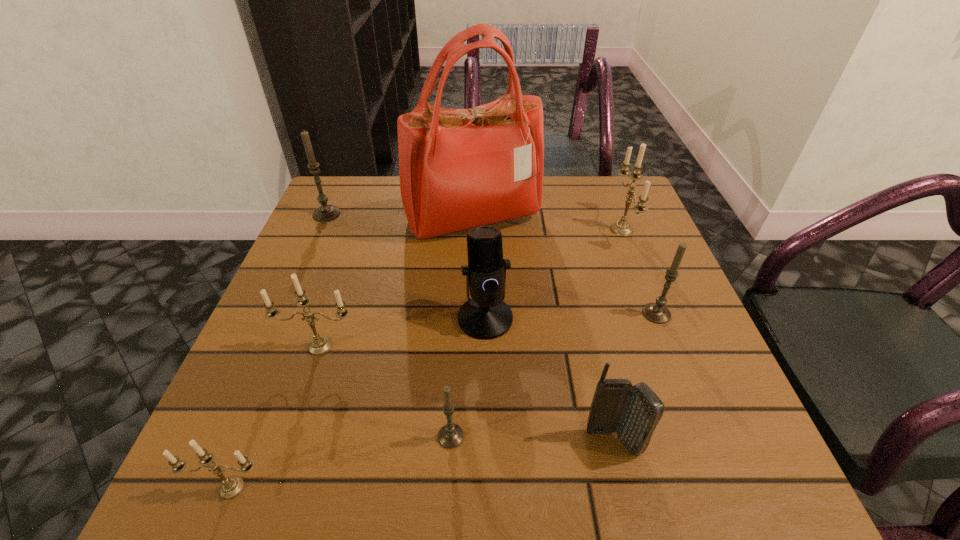
Locate an element on the screen. The height and width of the screenshot is (540, 960). empty space that is in between the leftmost gray candle and the second gray candle from right to left is located at coordinates (389, 325).

At what (x,y) coordinates should I click in order to perform the action: click on free space between the second farthest gray candle and the tallest object. Please return your answer as a coordinate pair (x, y). Looking at the image, I should click on (564, 266).

Locate an element on the screen. object that stands as the second closest to the black microphone is located at coordinates point(450,436).

Find the location of a particular element. The width and height of the screenshot is (960, 540). the fifth closest object to the leftmost gray candle is located at coordinates (231, 487).

You are a GUI agent. You are given a task and a screenshot of the screen. Output one action in this format:
    pyautogui.click(x=<x>, y=<y>)
    Task: Click on the candle object that ranks as the fourth closest to the rightmost gray candle
    The image size is (960, 540).
    Given the screenshot: What is the action you would take?
    pyautogui.click(x=231, y=487)

The width and height of the screenshot is (960, 540). Identify the location of candle that stands as the second closest to the second farthest gray candle. (450, 436).

Locate which metallic candle ranks second in proximity to the red handbag. Please provide its 2D coordinates. Your answer should be formatted as a tuple, i.e. [(x, y)], where the tuple contains the x and y coordinates of a point satisfying the conditions above.

[(320, 345)]

Identify which metallic candle is the closest to the rightmost gray candle. Please provide its 2D coordinates. Your answer should be formatted as a tuple, i.e. [(x, y)], where the tuple contains the x and y coordinates of a point satisfying the conditions above.

[(621, 228)]

Identify the location of gray candle that is the second closest to the black microphone. This screenshot has width=960, height=540. (656, 312).

Identify which gray candle is located as the third nearest to the biggest metallic candle. Please provide its 2D coordinates. Your answer should be formatted as a tuple, i.e. [(x, y)], where the tuple contains the x and y coordinates of a point satisfying the conditions above.

[(325, 212)]